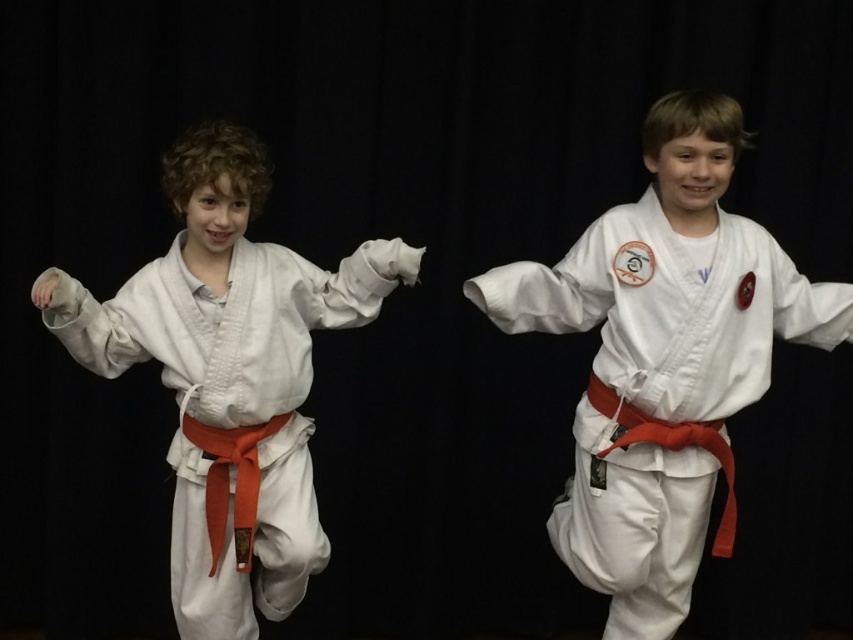
Question: Is white matte karate uniform at center smaller than white cotton karate uniform at left?

Choices:
 (A) yes
 (B) no

Answer: (B)

Question: Which object appears closest to the camera in this image?

Choices:
 (A) white matte karate uniform at center
 (B) white cotton karate uniform at left

Answer: (B)

Question: Which point is farther from the camera taking this photo?

Choices:
 (A) (618, 282)
 (B) (228, 568)

Answer: (B)

Question: Does white matte karate uniform at center come behind white cotton karate uniform at left?

Choices:
 (A) yes
 (B) no

Answer: (A)

Question: Is white matte karate uniform at center smaller than white cotton karate uniform at left?

Choices:
 (A) yes
 (B) no

Answer: (B)